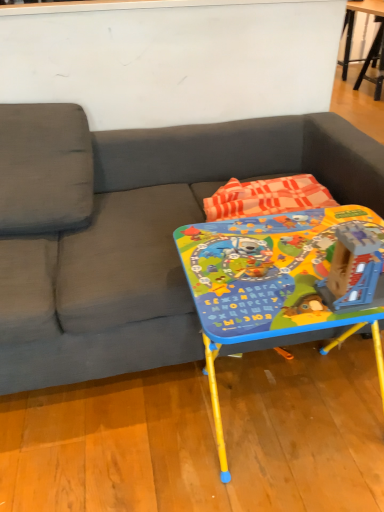
Question: Does plastic blue building at center contain matte plastic table at center, the first table in the left-to-right sequence?

Choices:
 (A) yes
 (B) no

Answer: (B)

Question: From the image's perspective, is plastic blue building at center located beneath matte plastic table at center, which ranks as the 2th table in right-to-left order?

Choices:
 (A) yes
 (B) no

Answer: (B)

Question: Are plastic blue building at center and matte plastic table at center, which is the second table in back-to-front order, far apart?

Choices:
 (A) yes
 (B) no

Answer: (B)

Question: Considering the relative sizes of plastic blue building at center and matte plastic table at center, the first table in the front-to-back sequence, in the image provided, is plastic blue building at center shorter than matte plastic table at center, the first table in the front-to-back sequence,?

Choices:
 (A) no
 (B) yes

Answer: (B)

Question: Is plastic blue building at center behind matte plastic table at center, which ranks as the 2th table in right-to-left order?

Choices:
 (A) yes
 (B) no

Answer: (B)

Question: From a real-world perspective, relative to wooden table at upper right, placed as the first table when sorted from right to left, is matte plastic table at center, arranged as the first table when ordered from the bottom, vertically above or below?

Choices:
 (A) above
 (B) below

Answer: (B)

Question: In terms of height, does matte plastic table at center, marked as the 2th table in a top-to-bottom arrangement, look taller or shorter compared to wooden table at upper right, which ranks as the 2th table in left-to-right order?

Choices:
 (A) short
 (B) tall

Answer: (A)

Question: Relative to wooden table at upper right, placed as the first table when sorted from right to left, is matte plastic table at center, the first table in the left-to-right sequence, in front or behind?

Choices:
 (A) front
 (B) behind

Answer: (A)

Question: Is point (258, 291) closer or farther from the camera than point (380, 20)?

Choices:
 (A) closer
 (B) farther

Answer: (A)

Question: In the image, is plastic blue building at center on the left side or the right side of matte plastic table at center, the first table in the left-to-right sequence?

Choices:
 (A) right
 (B) left

Answer: (A)

Question: Looking at their shapes, would you say plastic blue building at center is wider or thinner than matte plastic table at center, marked as the 2th table in a top-to-bottom arrangement?

Choices:
 (A) thin
 (B) wide

Answer: (A)

Question: From a real-world perspective, is plastic blue building at center positioned above or below matte plastic table at center, which ranks as the 2th table in right-to-left order?

Choices:
 (A) above
 (B) below

Answer: (A)

Question: From their relative heights in the image, would you say plastic blue building at center is taller or shorter than matte plastic table at center, the first table in the front-to-back sequence?

Choices:
 (A) short
 (B) tall

Answer: (A)

Question: Considering the positions of point [205, 236] and point [109, 273], is point [205, 236] closer or farther from the camera than point [109, 273]?

Choices:
 (A) farther
 (B) closer

Answer: (B)

Question: From a real-world perspective, is matte plastic table at center, marked as the 2th table in a top-to-bottom arrangement, physically located above or below gray fabric couch at center?

Choices:
 (A) above
 (B) below

Answer: (B)